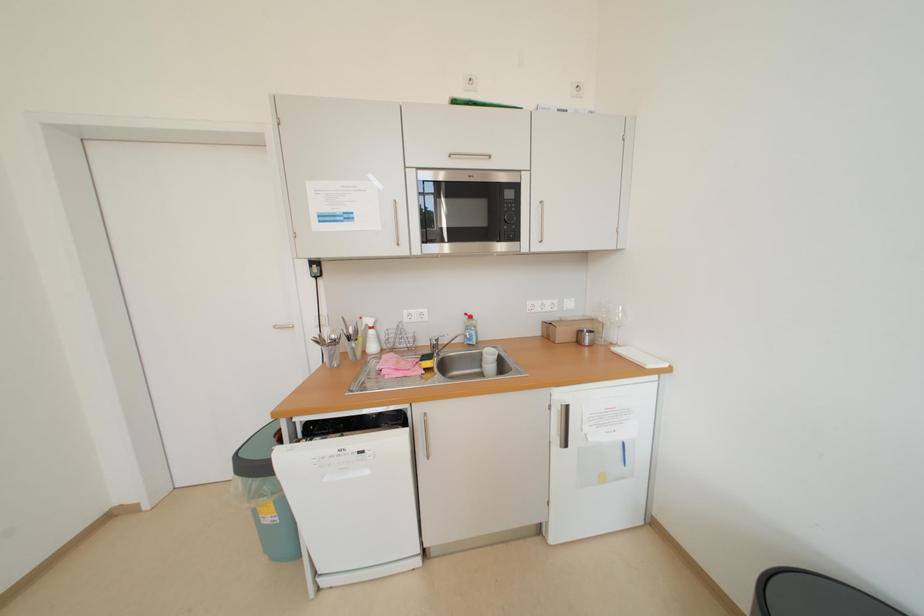
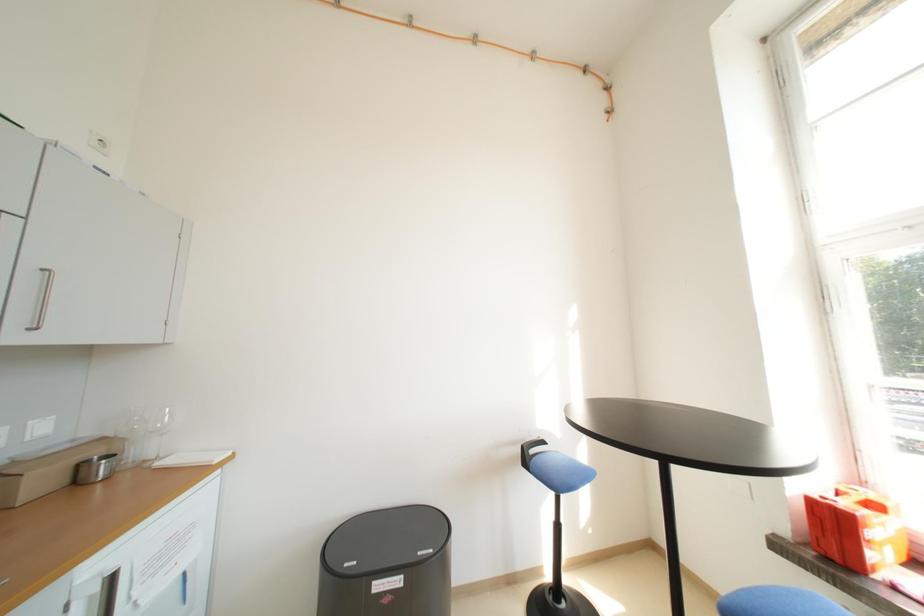
Question: The camera is either moving clockwise (left) or counter-clockwise (right) around the object. The first image is from the beginning of the video and the second image is from the end. Is the camera moving left or right when shooting the video?

Choices:
 (A) Left
 (B) Right

Answer: (A)